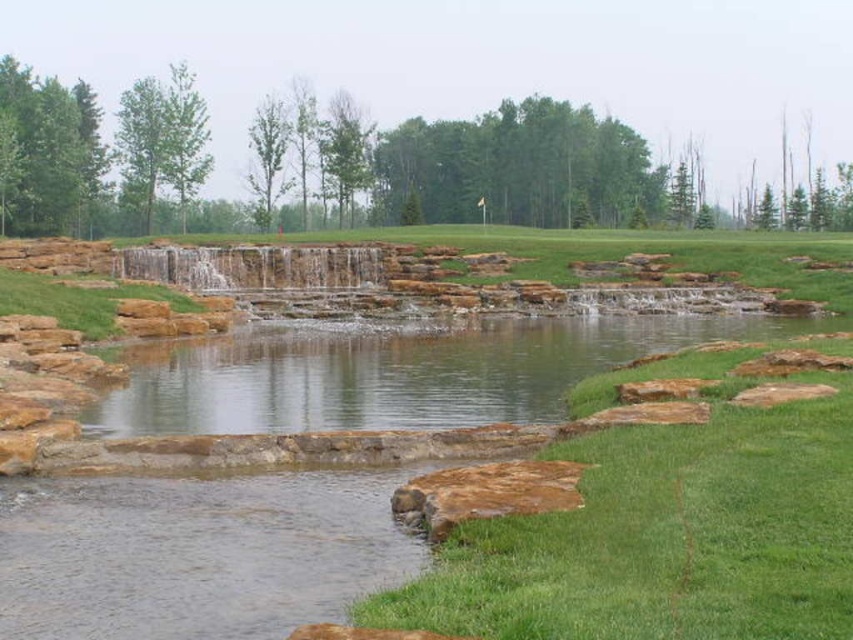
Is green grass at lower center smaller than clear water at center?

Correct, green grass at lower center occupies less space than clear water at center.

Is point (695, 540) closer to viewer compared to point (682, 346)?

Yes, it is.

Which is behind, point (775, 600) or point (238, 428)?

The point (238, 428) is behind.

Find the location of a particular element. green grass at lower center is located at coordinates (666, 525).